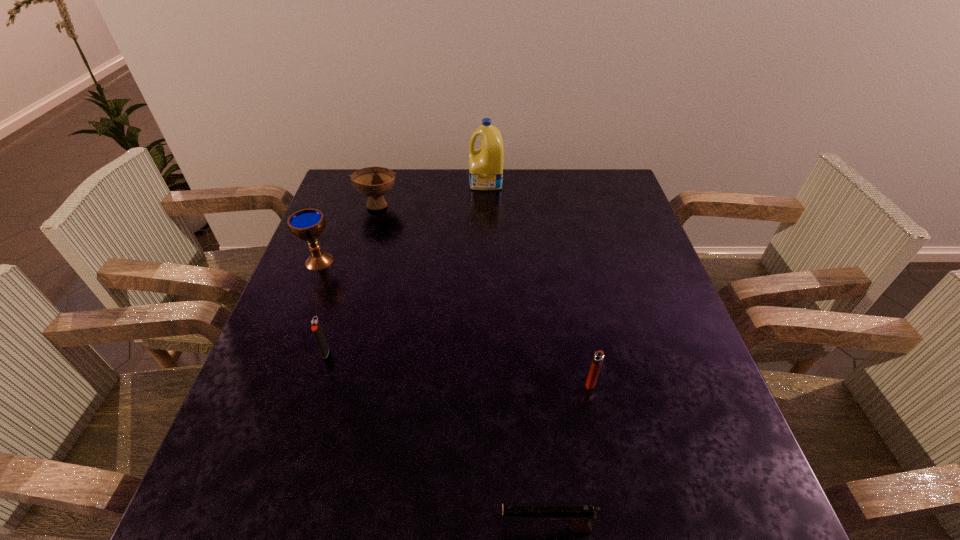
Where is `vacant space located on the label of the farthest object`? This screenshot has height=540, width=960. vacant space located on the label of the farthest object is located at coordinates (390, 183).

This screenshot has height=540, width=960. In order to click on vacant area situated 0.160m on the label of the farthest object in this screenshot , I will do `click(420, 183)`.

Find the location of a particular element. The height and width of the screenshot is (540, 960). vacant space located 0.370m on the label of the farthest object is located at coordinates (355, 183).

Image resolution: width=960 pixels, height=540 pixels. Identify the location of vacant space located 0.070m on the back of the third farthest object. (330, 234).

The width and height of the screenshot is (960, 540). Identify the location of vacant area situated 0.090m on the front of the second farthest object. (370, 236).

The width and height of the screenshot is (960, 540). What are the coordinates of `free region located on the back of the left igniter` in the screenshot? It's located at (353, 262).

The image size is (960, 540). Find the location of `vacant position located on the back of the right igniter`. vacant position located on the back of the right igniter is located at coordinates (574, 301).

At what (x,y) coordinates should I click in order to perform the action: click on vacant space located at the muzzle of the pistol. Please return your answer as a coordinate pair (x, y). The width and height of the screenshot is (960, 540). Looking at the image, I should click on (394, 528).

Find the location of a particular element. This screenshot has width=960, height=540. free space located 0.320m at the muzzle of the pistol is located at coordinates (300, 528).

This screenshot has height=540, width=960. Identify the location of free space located at the muzzle of the pistol. (344, 528).